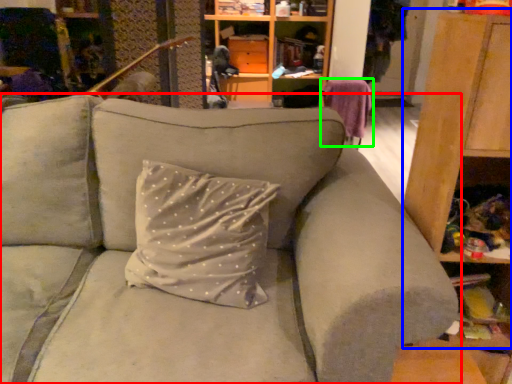
Question: Which object is the farthest from studio couch (highlighted by a red box)? Choose among these: dresser (highlighted by a blue box) or swivel chair (highlighted by a green box).

Choices:
 (A) dresser
 (B) swivel chair

Answer: (B)